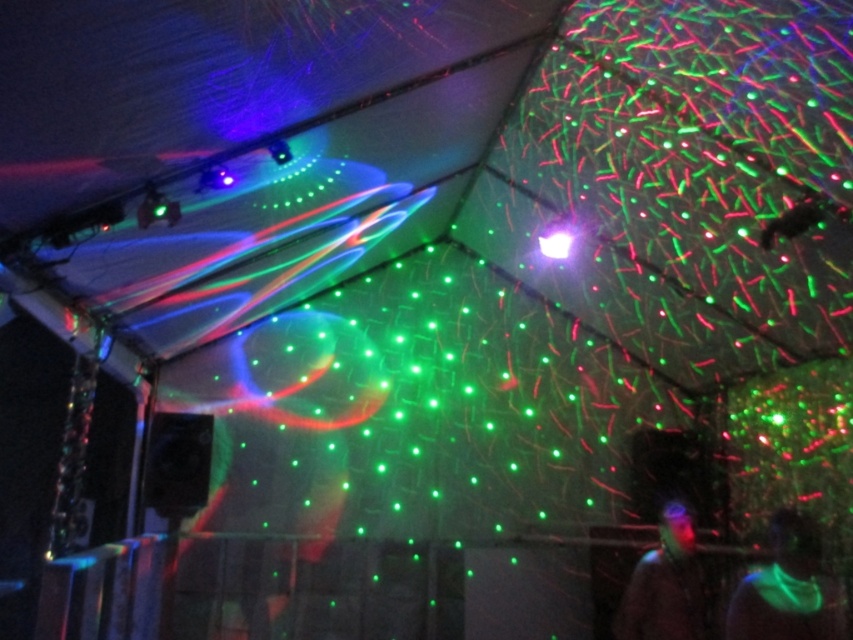
You are at a party inside the tent and want to take a photo of the translucent plastic head at center without any interference from the neon green glowing vest at lower right. Is the vest blocking the view of the head?

The neon green glowing vest at lower right is positioned over the translucent plastic head at center, so it is blocking the view of the head. You might need to move to a different angle to capture the head without the vest obstructing it.

You are a photographer holding a camera and need to capture the neon green glowing vest at lower right in your shot. The vest is glowing brightly, and you want to ensure it stands out against the colorful laser lights. Given that the vest and camera are 8.64 feet apart, what is the minimum distance you should maintain between yourself and the vest to ensure proper focus?

The minimum distance you should maintain between yourself and the neon green glowing vest at lower right is 8.64 feet to ensure proper focus, as that is the distance between the camera and the vest.

You are standing inside the tent and want to hand a neon green glowing vest at lower right to someone near the translucent plastic head at center. Can you reach the vest without moving closer to it?

The neon green glowing vest at lower right is closer to the viewer than the translucent plastic head at center, so you can reach the vest without moving closer to it.